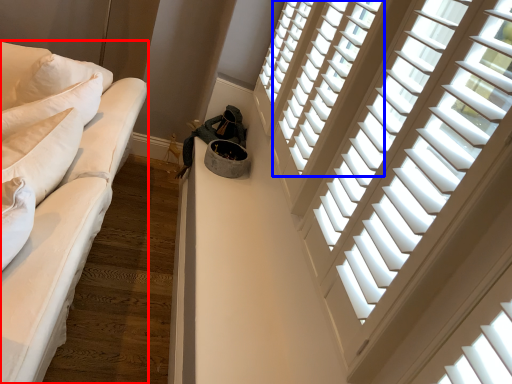
Question: Among these objects, which one is nearest to the camera, studio couch (highlighted by a red box) or window (highlighted by a blue box)?

Choices:
 (A) studio couch
 (B) window

Answer: (A)